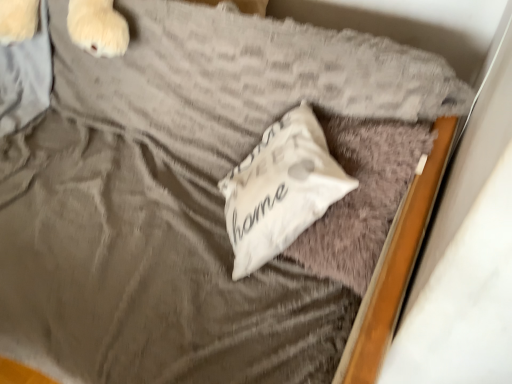
Question: Is white soft pillow at center, arranged as the 1th pillow when viewed from the left, wider than white soft pillow at center, placed as the 1th pillow when sorted from right to left?

Choices:
 (A) yes
 (B) no

Answer: (B)

Question: Is white soft pillow at center, arranged as the 2th pillow when viewed from the right, next to white soft pillow at center, which is counted as the second pillow, starting from the left, and touching it?

Choices:
 (A) yes
 (B) no

Answer: (B)

Question: From a real-world perspective, does white soft pillow at center, arranged as the 2th pillow when viewed from the right, stand above white soft pillow at center, which is counted as the second pillow, starting from the left?

Choices:
 (A) yes
 (B) no

Answer: (A)

Question: Does white soft pillow at center, arranged as the 1th pillow when viewed from the left, have a lesser height compared to white soft pillow at center, which is counted as the second pillow, starting from the left?

Choices:
 (A) no
 (B) yes

Answer: (B)

Question: From a real-world perspective, is white soft pillow at center, arranged as the 1th pillow when viewed from the left, under white soft pillow at center, which is counted as the second pillow, starting from the left?

Choices:
 (A) no
 (B) yes

Answer: (A)

Question: Is white soft pillow at center, arranged as the 1th pillow when viewed from the left, looking in the opposite direction of white soft pillow at center, placed as the 1th pillow when sorted from right to left?

Choices:
 (A) no
 (B) yes

Answer: (B)

Question: From the image's perspective, is white soft pillow at center, which is counted as the second pillow, starting from the left, on top of white soft pillow at center, arranged as the 1th pillow when viewed from the left?

Choices:
 (A) no
 (B) yes

Answer: (A)

Question: From the image's perspective, is white soft pillow at center, which is counted as the second pillow, starting from the left, beneath white soft pillow at center, arranged as the 2th pillow when viewed from the right?

Choices:
 (A) yes
 (B) no

Answer: (A)

Question: Does white soft pillow at center, which is counted as the second pillow, starting from the left, have a larger size compared to white soft pillow at center, arranged as the 2th pillow when viewed from the right?

Choices:
 (A) yes
 (B) no

Answer: (A)

Question: Considering the relative positions of white soft pillow at center, which is counted as the second pillow, starting from the left, and white soft pillow at center, arranged as the 2th pillow when viewed from the right, in the image provided, is white soft pillow at center, which is counted as the second pillow, starting from the left, to the left of white soft pillow at center, arranged as the 2th pillow when viewed from the right, from the viewer's perspective?

Choices:
 (A) yes
 (B) no

Answer: (B)

Question: Is white soft pillow at center, which is counted as the second pillow, starting from the left, completely or partially outside of white soft pillow at center, arranged as the 2th pillow when viewed from the right?

Choices:
 (A) no
 (B) yes

Answer: (A)

Question: Is white soft pillow at center, placed as the 1th pillow when sorted from right to left, surrounding white soft pillow at center, arranged as the 2th pillow when viewed from the right?

Choices:
 (A) no
 (B) yes

Answer: (B)

Question: Looking at their shapes, would you say white soft pillow at center, arranged as the 2th pillow when viewed from the right, is wider or thinner than white soft pillow at center, which is counted as the second pillow, starting from the left?

Choices:
 (A) thin
 (B) wide

Answer: (A)